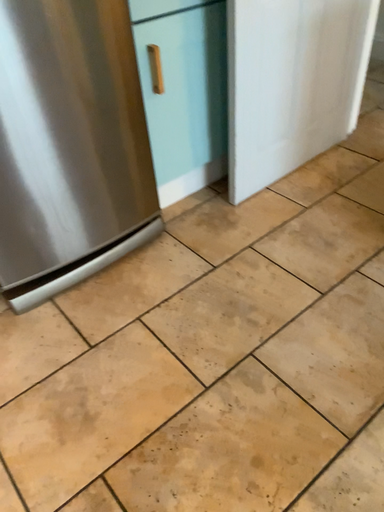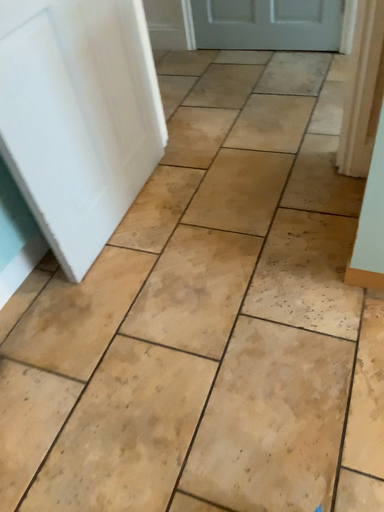
Question: Which way did the camera rotate in the video?

Choices:
 (A) rotated left
 (B) rotated right

Answer: (B)